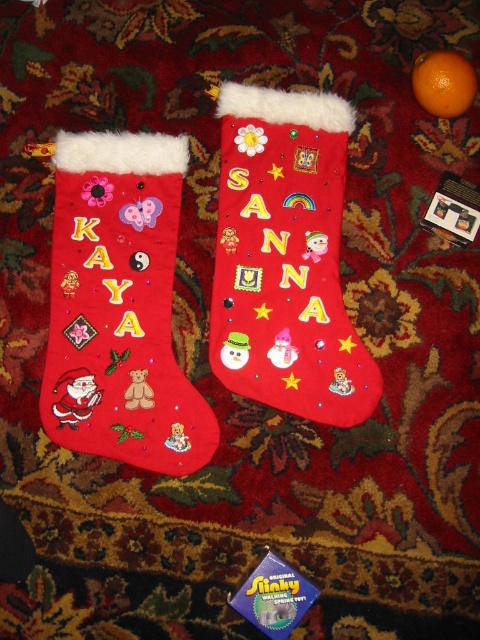
You are standing in front of the two Christmas stockings on the carpet. You notice two points marked on the image. The first point is at coordinate (109, 224) and the second is at (454, 84). Which point is closer to you?

Point (454, 84) is closer to you because it is in front of point (109, 224).